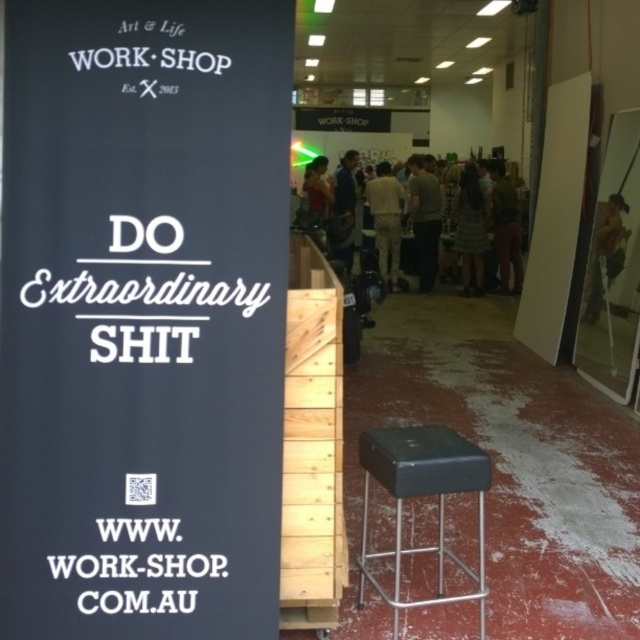
You are a visitor in this workshop and want to sit down on the black leather bar stool at lower right. However, you notice the light brown leather jacket at center is placed on top of it. Can you sit there comfortably?

The black leather bar stool at lower right is shorter than the light brown leather jacket at center, which means the jacket is covering the seating area. Therefore, you cannot sit there comfortably until the jacket is removed.

You are a fashion designer who wants to display the dark gray dress at center and the dark brown leather jacket at center in a runway show. The runway is narrow, and you need to know if the two garments can be displayed side by side without overlapping. The runway has a width of 2 meters. Can they be placed side by side?

The distance between the dark gray dress at center and dark brown leather jacket at center is 1.73 meters. Since the runway is 2 meters wide, which is wider than the distance between them, they can be displayed side by side without overlapping.

You are a tailor who needs to determine which garment takes up more vertical space in the center of the workshop. Based on the scene, which one is taller between the light brown leather jacket at center and the dark gray dress at center?

The light brown leather jacket at center is taller than the dark gray dress at center.